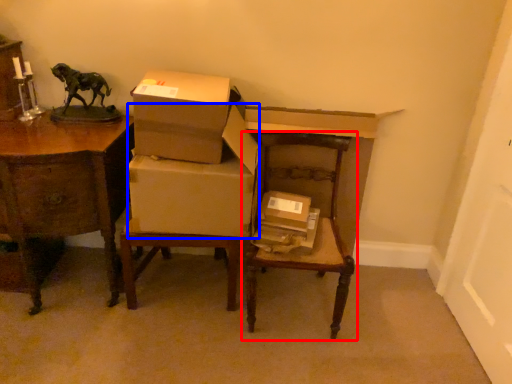
Question: Which point is closer to the camera, chair (highlighted by a red box) or cardboard box (highlighted by a blue box)?

Choices:
 (A) chair
 (B) cardboard box

Answer: (A)